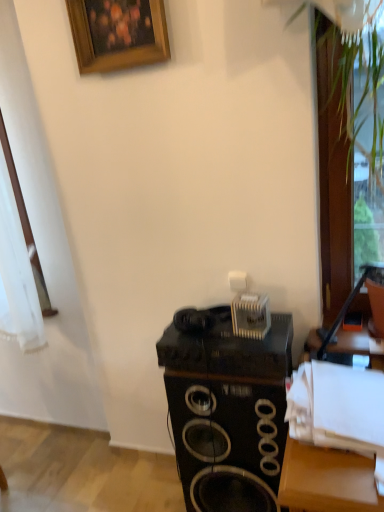
What is the approximate width of transparent glass door at right?

transparent glass door at right is 30.46 centimeters wide.

Locate an element on the screen. Image resolution: width=384 pixels, height=512 pixels. wooden picture frame at upper center is located at coordinates pos(118,34).

Locate an element on the screen. This screenshot has width=384, height=512. black matte speaker at center is located at coordinates (227, 440).

Measure the distance between point [275,414] and camera.

They are 4.60 feet apart.

Where is `transparent glass door at right`? This screenshot has height=512, width=384. transparent glass door at right is located at coordinates (348, 145).

Is wooden picture frame at upper center oriented away from transparent glass door at right?

No, transparent glass door at right is not at the back of wooden picture frame at upper center.

Is point (107, 51) positioned behind point (350, 201)?

No, (107, 51) is closer to viewer.

Consider the image. In terms of height, does wooden picture frame at upper center look taller or shorter compared to transparent glass door at right?

In the image, wooden picture frame at upper center appears to be shorter than transparent glass door at right.

Is wooden picture frame at upper center to the right of black matte speaker at center from the viewer's perspective?

Incorrect, wooden picture frame at upper center is not on the right side of black matte speaker at center.

From the image's perspective, is wooden picture frame at upper center under black matte speaker at center?

No.

Who is more distant, wooden picture frame at upper center or black matte speaker at center?

wooden picture frame at upper center.

Is there a large distance between wooden picture frame at upper center and black matte speaker at center?

That's right, there is a large distance between wooden picture frame at upper center and black matte speaker at center.

Does transparent glass door at right touch wooden picture frame at upper center?

No, transparent glass door at right is not next to wooden picture frame at upper center.

Between transparent glass door at right and wooden picture frame at upper center, which one has less height?

With less height is wooden picture frame at upper center.

Is wooden picture frame at upper center at the back of transparent glass door at right?

That's not correct — transparent glass door at right is not looking away from wooden picture frame at upper center.

Considering the relative positions of transparent glass door at right and wooden picture frame at upper center in the image provided, is transparent glass door at right to the left or to the right of wooden picture frame at upper center?

Based on their positions, transparent glass door at right is located to the right of wooden picture frame at upper center.

Is black matte speaker at center located outside transparent glass door at right?

Yes, black matte speaker at center is not within transparent glass door at right.

From the image's perspective, which one is positioned lower, black matte speaker at center or transparent glass door at right?

black matte speaker at center.

Is black matte speaker at center in contact with transparent glass door at right?

No.

Does black matte speaker at center appear on the right side of transparent glass door at right?

Incorrect, black matte speaker at center is not on the right side of transparent glass door at right.

Considering the points (231, 479) and (89, 56), which point is behind, point (231, 479) or point (89, 56)?

The point (231, 479) is behind.

From a real-world perspective, which object rests below the other?

From a 3D spatial view, black matte speaker at center is below.

Who is taller, black matte speaker at center or wooden picture frame at upper center?

black matte speaker at center.

Measure the distance from transparent glass door at right to black matte speaker at center.

Answer: They are 28.76 inches apart.

Which of these two, transparent glass door at right or black matte speaker at center, is bigger?

black matte speaker at center.

Considering the sizes of objects transparent glass door at right and black matte speaker at center in the image provided, who is shorter, transparent glass door at right or black matte speaker at center?

black matte speaker at center is shorter.

Is point (364, 44) positioned behind point (179, 411)?

That is False.

Find the location of a particular element. picture frame above the transparent glass door at right (from the image's perspective) is located at coordinates (118, 34).

This screenshot has width=384, height=512. In order to click on picture frame lying on the left of black matte speaker at center in this screenshot , I will do `click(118, 34)`.

Considering their positions, is wooden picture frame at upper center positioned closer to transparent glass door at right than black matte speaker at center?

wooden picture frame at upper center lies closer to transparent glass door at right than the other object.

Which object lies further to the anchor point transparent glass door at right, black matte speaker at center or wooden picture frame at upper center?

black matte speaker at center is positioned further to the anchor transparent glass door at right.

Estimate the real-world distances between objects in this image. Which object is further from wooden picture frame at upper center, transparent glass door at right or black matte speaker at center?

black matte speaker at center is further to wooden picture frame at upper center.

Based on their spatial positions, is transparent glass door at right or wooden picture frame at upper center closer to black matte speaker at center?

transparent glass door at right.

When comparing their distances from black matte speaker at center, does wooden picture frame at upper center or transparent glass door at right seem closer?

Among the two, transparent glass door at right is located nearer to black matte speaker at center.

Based on their spatial positions, is black matte speaker at center or transparent glass door at right closer to wooden picture frame at upper center?

Among the two, transparent glass door at right is located nearer to wooden picture frame at upper center.

The image size is (384, 512). In order to click on glass door between wooden picture frame at upper center and black matte speaker at center in the up-down direction in this screenshot , I will do `click(348, 145)`.